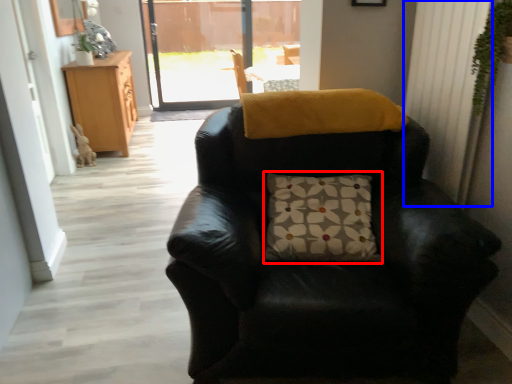
Question: Among these objects, which one is nearest to the camera, pillow (highlighted by a red box) or curtain (highlighted by a blue box)?

Choices:
 (A) pillow
 (B) curtain

Answer: (B)